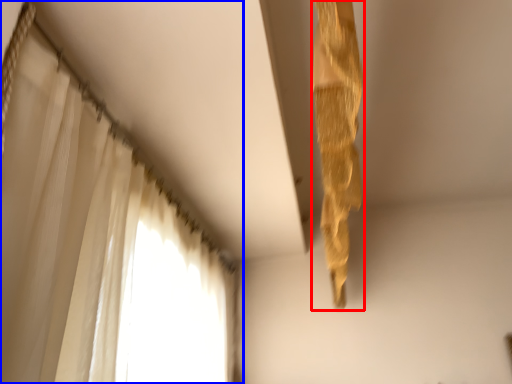
Question: Which object appears closest to the camera in this image, curtain (highlighted by a red box) or curtain (highlighted by a blue box)?

Choices:
 (A) curtain
 (B) curtain

Answer: (B)